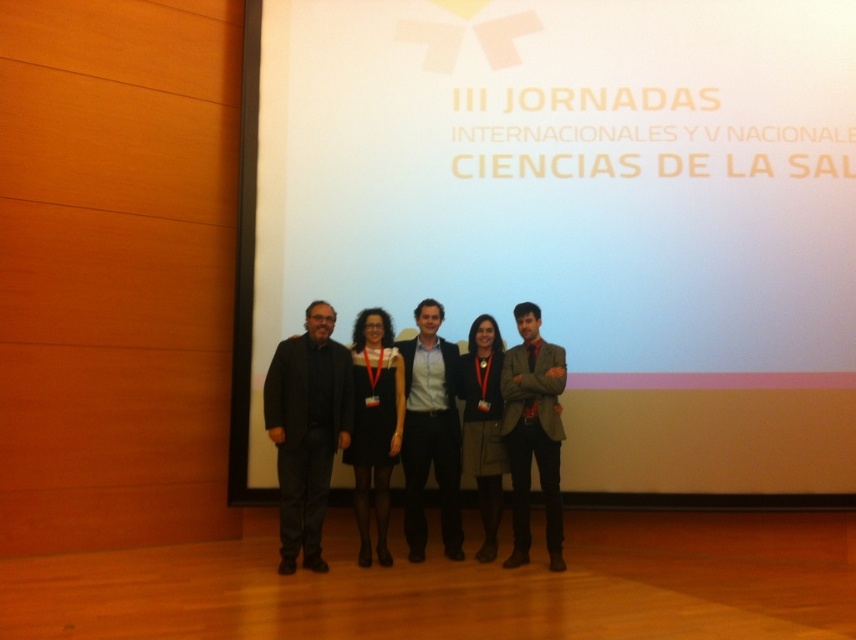
Question: Based on their relative distances, which object is nearer to the dark gray wool coat at center?

Choices:
 (A) black matte suit at left
 (B) white matte projection screen at center
 (C) matte gray blazer at center
 (D) light blue shirt at center

Answer: (C)

Question: Which point appears closest to the camera in this image?

Choices:
 (A) (319, 544)
 (B) (385, 532)
 (C) (435, 74)
 (D) (421, 531)

Answer: (A)

Question: Estimate the real-world distances between objects in this image. Which object is farther from the white matte projection screen at center?

Choices:
 (A) black matte dress at center
 (B) dark gray wool coat at center
 (C) matte gray blazer at center
 (D) light blue shirt at center

Answer: (C)

Question: Can you confirm if black matte suit at left is bigger than dark gray wool coat at center?

Choices:
 (A) no
 (B) yes

Answer: (B)

Question: Does black matte suit at left appear on the left side of dark gray wool coat at center?

Choices:
 (A) yes
 (B) no

Answer: (A)

Question: Is black matte suit at left bigger than dark gray wool coat at center?

Choices:
 (A) yes
 (B) no

Answer: (A)